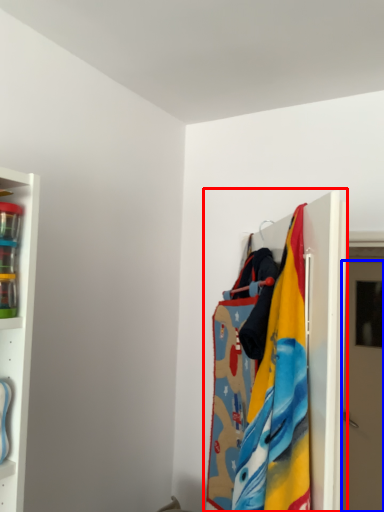
Question: Among these objects, which one is nearest to the camera, closet (highlighted by a red box) or door (highlighted by a blue box)?

Choices:
 (A) closet
 (B) door

Answer: (A)